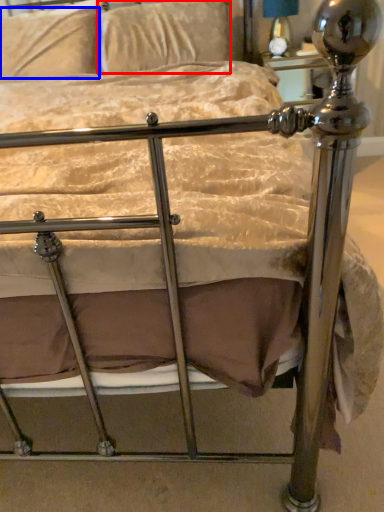
Question: Which object is closer to the camera taking this photo, pillow (highlighted by a red box) or pillow (highlighted by a blue box)?

Choices:
 (A) pillow
 (B) pillow

Answer: (A)